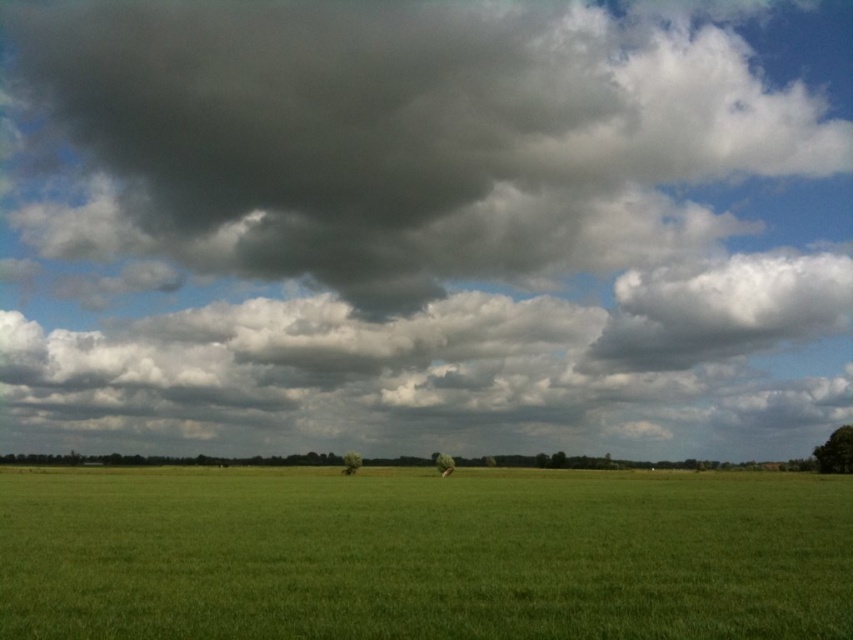
Question: Which point is farther from the camera taking this photo?

Choices:
 (A) (693, 272)
 (B) (264, 602)
 (C) (154, 147)

Answer: (C)

Question: Which of these objects is positioned closest to the dark gray cloud at upper center?

Choices:
 (A) white fluffy cloud at upper right
 (B) green grass at center

Answer: (A)

Question: Does dark gray cloud at upper center appear on the left side of white fluffy cloud at upper right?

Choices:
 (A) no
 (B) yes

Answer: (B)

Question: Can you confirm if green grass at center is positioned below white fluffy cloud at upper right?

Choices:
 (A) yes
 (B) no

Answer: (A)

Question: Is dark gray cloud at upper center thinner than white fluffy cloud at upper right?

Choices:
 (A) no
 (B) yes

Answer: (A)

Question: Which point appears farthest from the camera in this image?

Choices:
 (A) (364, 525)
 (B) (67, 228)

Answer: (B)